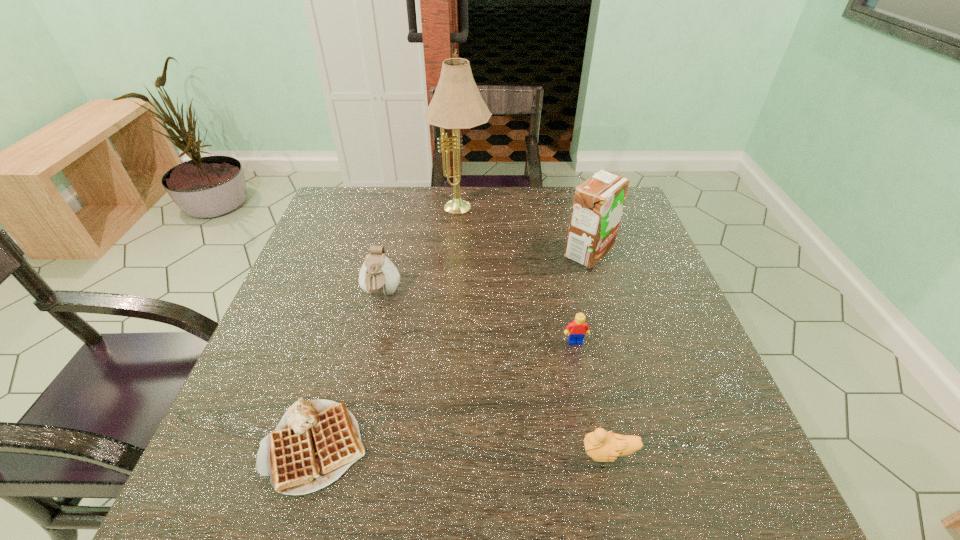
You are a GUI agent. You are given a task and a screenshot of the screen. Output one action in this format:
    pyautogui.click(x=<x>, y=<y>)
    Task: Click on the empty space between the pouch and the third object from left to right
    The image size is (960, 540).
    Given the screenshot: What is the action you would take?
    pyautogui.click(x=421, y=252)

Where is `blank region between the second farthest object and the third nearest object`? The width and height of the screenshot is (960, 540). blank region between the second farthest object and the third nearest object is located at coordinates (582, 297).

Locate an element on the screen. The image size is (960, 540). vacant area that lies between the second shortest object and the third farthest object is located at coordinates [494, 374].

Identify the location of vacant area between the Lego and the duckling. (592, 397).

The height and width of the screenshot is (540, 960). What are the coordinates of `free space between the duckling and the fourth object from right to left` in the screenshot? It's located at (535, 332).

The image size is (960, 540). Find the location of `vacant area between the second farthest object and the tallest object`. vacant area between the second farthest object and the tallest object is located at coordinates (525, 231).

You are a GUI agent. You are given a task and a screenshot of the screen. Output one action in this format:
    pyautogui.click(x=<x>, y=<y>)
    Task: Click on the free space between the lampshade and the duckling
    
    Given the screenshot: What is the action you would take?
    pyautogui.click(x=535, y=332)

Identify the location of vacant space that's between the second tallest object and the third farthest object. This screenshot has width=960, height=540. (485, 274).

Locate an element on the screen. free point between the fifth shortest object and the waffle is located at coordinates (452, 349).

Where is `object that stands as the second closest to the shortest object`? The image size is (960, 540). object that stands as the second closest to the shortest object is located at coordinates (601, 446).